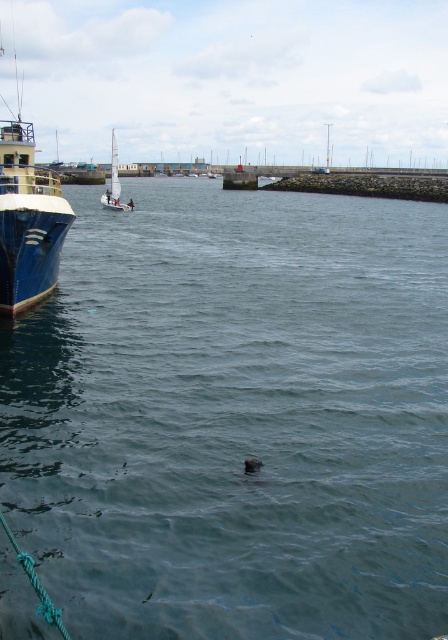
Question: Is clear blue water at center thinner than blue glossy boat at left?

Choices:
 (A) yes
 (B) no

Answer: (A)

Question: Does clear blue water at center appear on the left side of blue glossy boat at left?

Choices:
 (A) yes
 (B) no

Answer: (B)

Question: Does clear blue water at center have a lesser width compared to blue glossy boat at left?

Choices:
 (A) yes
 (B) no

Answer: (A)

Question: Which object is closer to the camera taking this photo?

Choices:
 (A) blue glossy boat at left
 (B) clear blue water at center

Answer: (B)

Question: Which point appears closest to the camera in this image?

Choices:
 (A) (12, 268)
 (B) (298, 595)
 (C) (115, 154)

Answer: (B)

Question: Which of the following is the closest to the observer?

Choices:
 (A) blue glossy boat at left
 (B) white sailboat at center

Answer: (A)